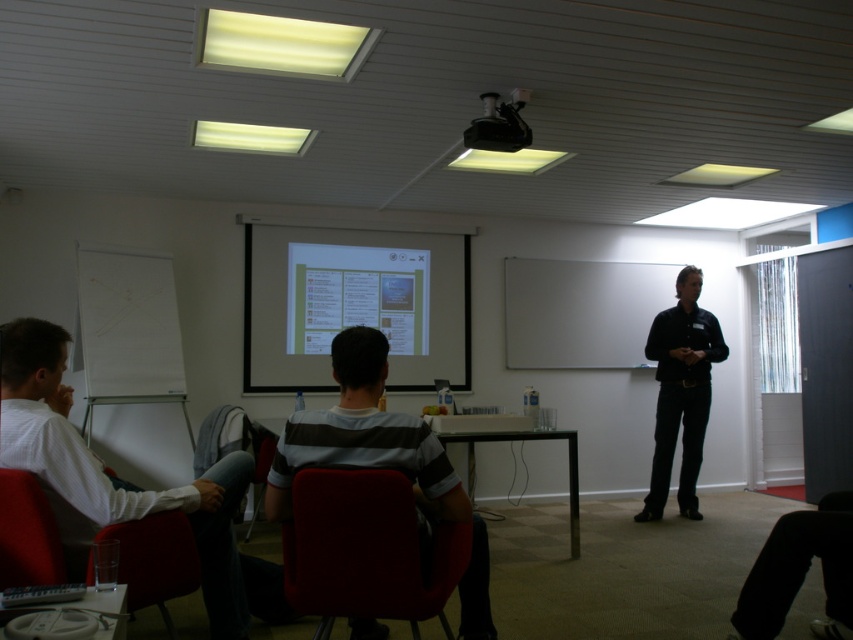
You are organizing a small event and need to arrange seating for attendees. You have a velvet red chair at center and a black smooth shirt at center. Which object should you choose if you want to save space?

The velvet red chair at center occupies less space than black smooth shirt at center, so you should choose the velvet red chair at center to save space.

You are standing at the presenter position facing the audience. There are two points marked in the room. The first point is at coordinate point (444,589) and the second point is at coordinate point (683,396). Which point is closer to the audience members sitting on the red chairs?

Point (444,589) is in front of point (683,396), so it is closer to the audience members sitting on the red chairs.

You are sitting in the room and want to move from your current position near the matte red armchair at lower left to the matte white projector screen at center. Which direction should you move to reach it?

The matte white projector screen at center is positioned on the right side of the matte red armchair at lower left, so you should move to your right to reach it.